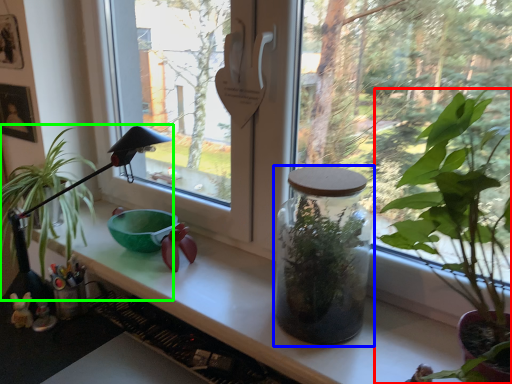
Question: Considering the real-world distances, which object is closest to houseplant (highlighted by a red box)? glass jar (highlighted by a blue box) or houseplant (highlighted by a green box).

Choices:
 (A) glass jar
 (B) houseplant

Answer: (A)